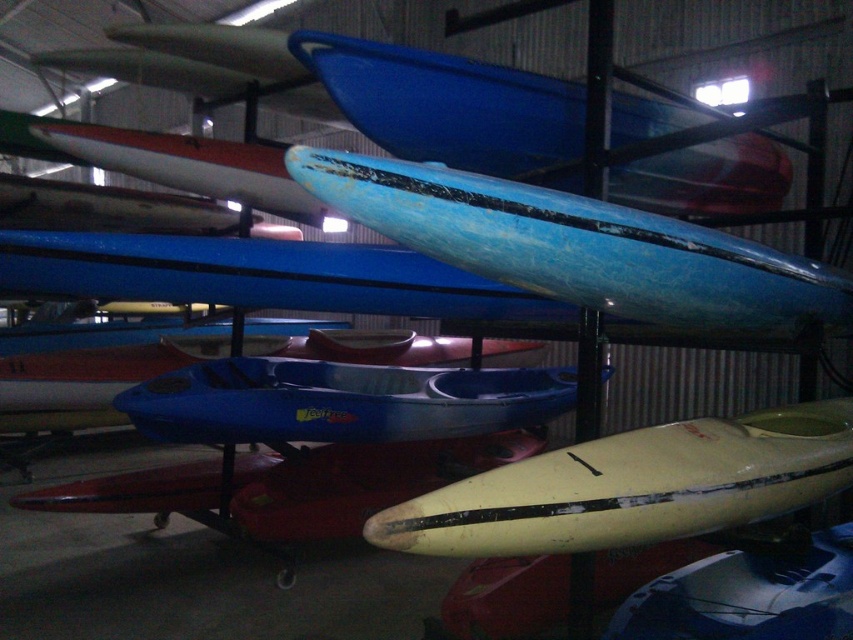
Question: Is blue matte kayak at center closer to the viewer compared to blue plastic kayak at upper center?

Choices:
 (A) no
 (B) yes

Answer: (B)

Question: Estimate the real-world distances between objects in this image. Which object is farther from the blue matte surfboard at upper center?

Choices:
 (A) blue matte kayak at center
 (B) blue plastic kayak at upper center

Answer: (A)

Question: Can you confirm if blue matte kayak at center is bigger than blue matte surfboard at upper center?

Choices:
 (A) yes
 (B) no

Answer: (A)

Question: Can you confirm if blue matte kayak at center is thinner than matte blue kayak at center?

Choices:
 (A) yes
 (B) no

Answer: (B)

Question: Which point appears farthest from the camera in this image?

Choices:
 (A) (759, 275)
 (B) (520, 131)
 (C) (148, 157)

Answer: (C)

Question: Which is nearer to the blue matte surfboard at upper center?

Choices:
 (A) blue plastic kayak at upper center
 (B) blue matte kayak at center
 (C) matte blue kayak at center

Answer: (A)